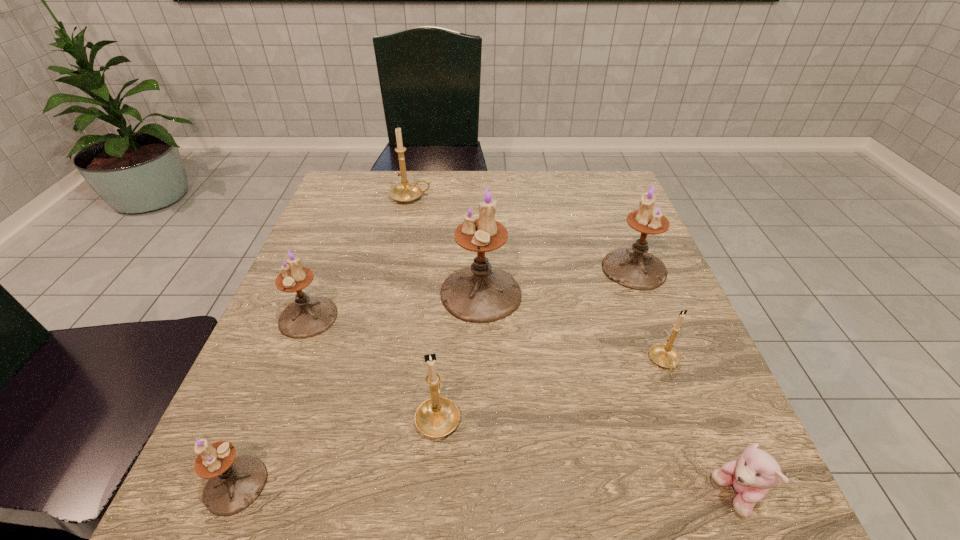
Identify the location of vacant point located between the shortest object and the tallest candle holder. The height and width of the screenshot is (540, 960). (609, 395).

Identify the location of free point between the second nearest gold candle holder and the second biggest purple candle holder. (649, 315).

At what (x,y) coordinates should I click in order to perform the action: click on free space between the third biggest purple candle holder and the smallest purple candle holder. Please return your answer as a coordinate pair (x, y). This screenshot has height=540, width=960. Looking at the image, I should click on (272, 401).

You are a GUI agent. You are given a task and a screenshot of the screen. Output one action in this format:
    pyautogui.click(x=<x>, y=<y>)
    Task: Click on the free space between the farthest object and the second smallest purple candle holder
    The width and height of the screenshot is (960, 540).
    Given the screenshot: What is the action you would take?
    pyautogui.click(x=360, y=257)

Identify the location of free point between the nearest purple candle holder and the teddy bear. (486, 490).

The height and width of the screenshot is (540, 960). Identify the location of vacant point located between the second purple candle holder from right to left and the shortest object. (609, 395).

Identify the location of vacant space that is in between the fifth candle holder from right to left and the second biggest gold candle holder. Image resolution: width=960 pixels, height=540 pixels. (424, 306).

Find the location of a particular element. The height and width of the screenshot is (540, 960). object that ranks as the fourth closest to the third nearest object is located at coordinates (663, 355).

Identify which object is located as the fourth nearest to the second farthest gold candle holder. Please provide its 2D coordinates. Your answer should be formatted as a tuple, i.e. [(x, y)], where the tuple contains the x and y coordinates of a point satisfying the conditions above.

[(436, 417)]

Select which candle holder is the closest to the third nearest candle holder. Please provide its 2D coordinates. Your answer should be formatted as a tuple, i.e. [(x, y)], where the tuple contains the x and y coordinates of a point satisfying the conditions above.

[(634, 268)]